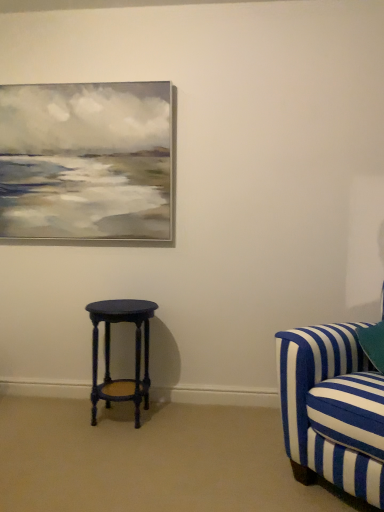
Question: Does matte dark blue stool at lower left have a lesser height compared to blue striped fabric couch at right?

Choices:
 (A) no
 (B) yes

Answer: (B)

Question: From a real-world perspective, is matte dark blue stool at lower left beneath blue striped fabric couch at right?

Choices:
 (A) no
 (B) yes

Answer: (B)

Question: Does matte dark blue stool at lower left have a smaller size compared to blue striped fabric couch at right?

Choices:
 (A) yes
 (B) no

Answer: (A)

Question: From a real-world perspective, is matte dark blue stool at lower left physically above blue striped fabric couch at right?

Choices:
 (A) no
 (B) yes

Answer: (A)

Question: From the image's perspective, is matte dark blue stool at lower left over blue striped fabric couch at right?

Choices:
 (A) yes
 (B) no

Answer: (B)

Question: Is matte dark blue stool at lower left oriented away from blue striped fabric couch at right?

Choices:
 (A) no
 (B) yes

Answer: (A)

Question: Is blue striped fabric couch at right in front of matte dark blue stool at lower left?

Choices:
 (A) yes
 (B) no

Answer: (A)

Question: Does blue striped fabric couch at right turn towards matte dark blue stool at lower left?

Choices:
 (A) no
 (B) yes

Answer: (A)

Question: Considering the relative positions of blue striped fabric couch at right and matte dark blue stool at lower left in the image provided, is blue striped fabric couch at right to the left of matte dark blue stool at lower left from the viewer's perspective?

Choices:
 (A) no
 (B) yes

Answer: (A)

Question: From a real-world perspective, is blue striped fabric couch at right over matte dark blue stool at lower left?

Choices:
 (A) no
 (B) yes

Answer: (B)

Question: Are blue striped fabric couch at right and matte dark blue stool at lower left making contact?

Choices:
 (A) yes
 (B) no

Answer: (B)

Question: Does blue striped fabric couch at right come behind matte dark blue stool at lower left?

Choices:
 (A) yes
 (B) no

Answer: (B)

Question: Visually, is blue striped fabric couch at right positioned to the left or to the right of matte dark blue stool at lower left?

Choices:
 (A) left
 (B) right

Answer: (B)